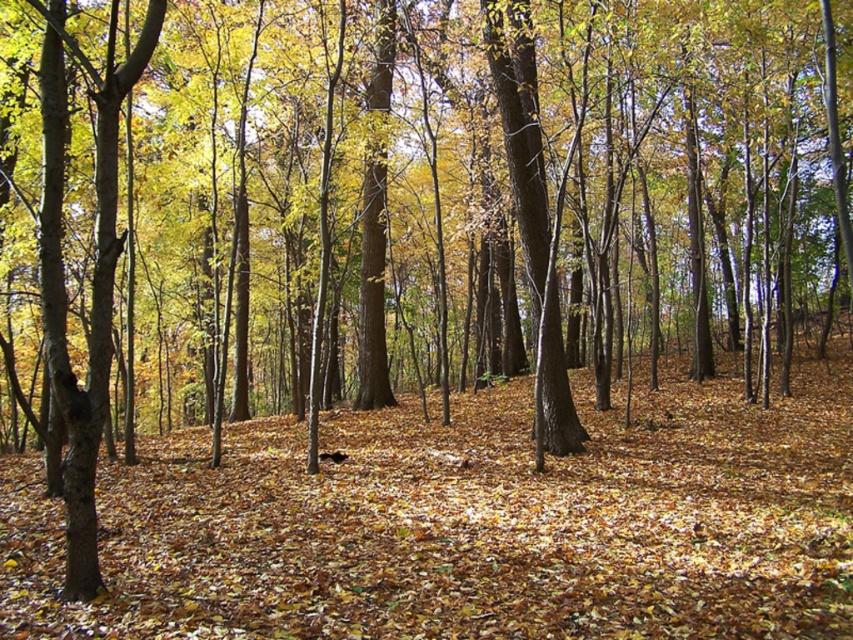
You are a hiker trying to cross the forest floor. You have to step over the brown leaf litter at center and the smooth brown tree trunk at left. Which one requires a larger step?

The brown leaf litter at center requires a larger step because it is bigger than the smooth brown tree trunk at left.

You are standing in the autumn forest scene described. You see the brown leaf litter at center and the smooth brown tree trunk at left. Which object is closer to the ground?

The brown leaf litter at center is closer to the ground because it is located below the smooth brown tree trunk at left.